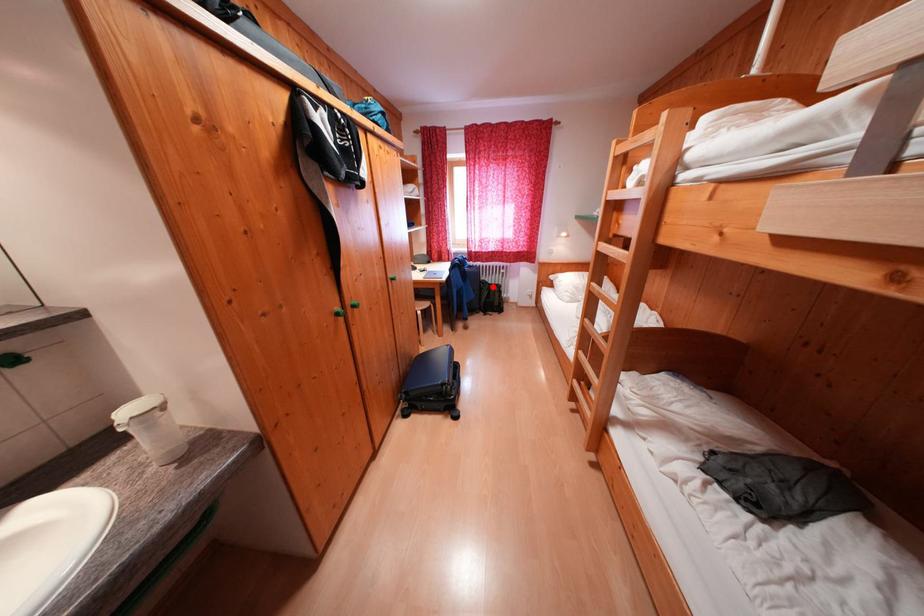
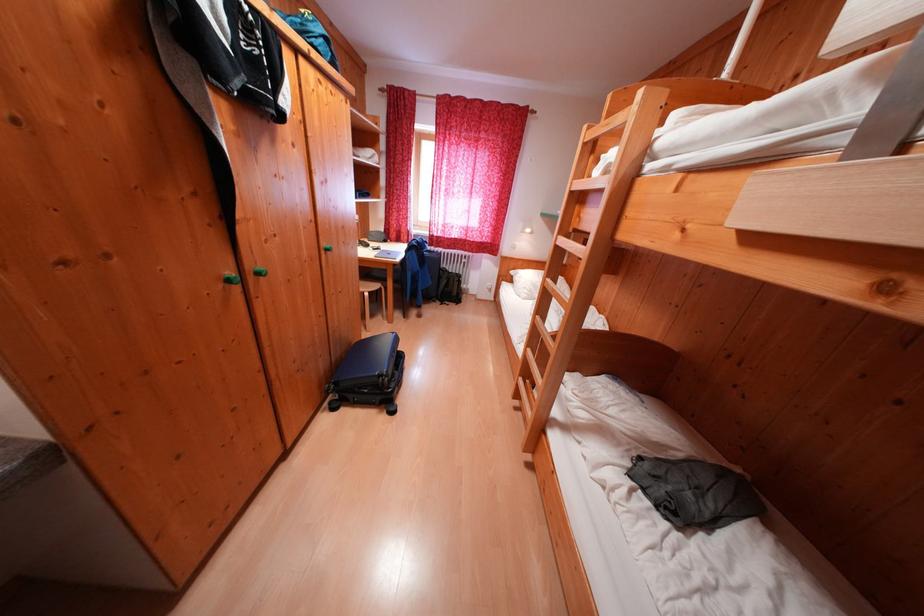
The point at the highlighted location is marked in the first image. Where is the corresponding point in the second image?

(454, 275)